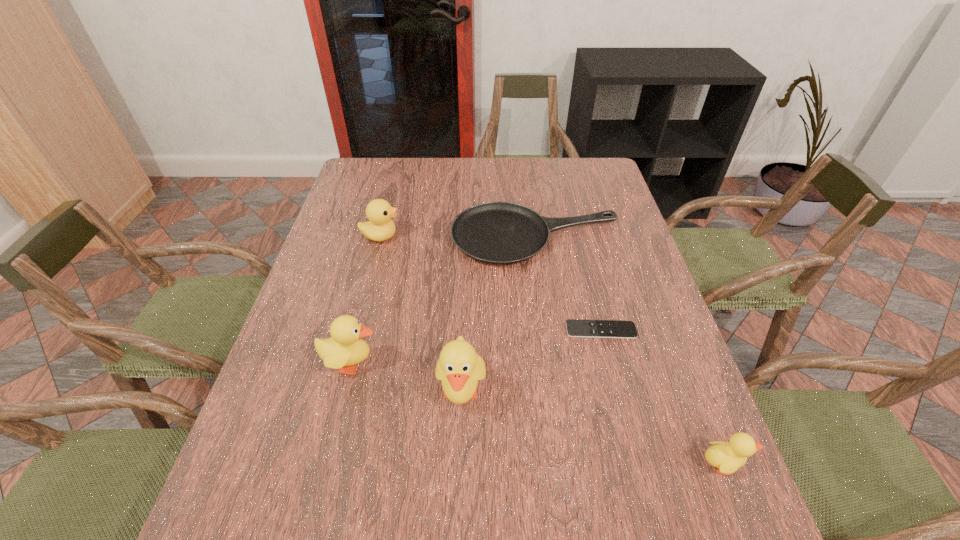
To ensure equal spacing by inserting another duckling among them, please point out a vacant spot for this new duckling. Please provide its 2D coordinates. Your answer should be formatted as a tuple, i.e. [(x, y)], where the tuple contains the x and y coordinates of a point satisfying the conditions above.

[(584, 426)]